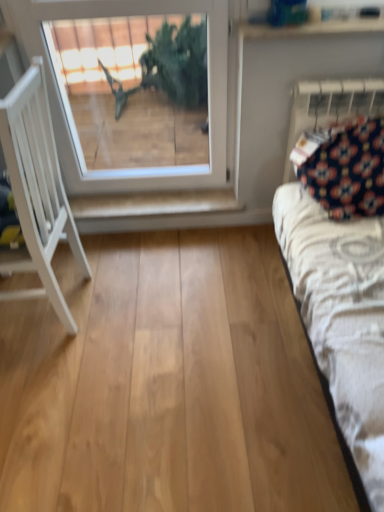
What is the approximate width of dark blue fabric at upper right?

It is 4.82 inches.

Where is `dark blue fabric at upper right`? The height and width of the screenshot is (512, 384). dark blue fabric at upper right is located at coordinates (330, 106).

From a real-world perspective, which is physically below, white painted wood shelf at center or white glass window at upper center?

From a 3D spatial view, white painted wood shelf at center is below.

Is white painted wood shelf at center outside of white glass window at upper center?

white painted wood shelf at center is positioned outside white glass window at upper center.

From the image's perspective, does white painted wood shelf at center appear lower than white glass window at upper center?

Yes, from the image's perspective, white painted wood shelf at center is below white glass window at upper center.

Relative to white glass window at upper center, is white painted wood shelf at center in front or behind?

white painted wood shelf at center is behind white glass window at upper center.

Is white glass window at upper center at the right side of white painted wood shelf at center?

No.

Looking at this image, can we say white glass window at upper center lies outside white painted wood shelf at center?

white glass window at upper center is positioned outside white painted wood shelf at center.

Locate an element on the screen. The image size is (384, 512). shelf that is on the right side of white glass window at upper center is located at coordinates (154, 204).

Does white glass window at upper center have a greater width compared to white painted wood shelf at center?

No.

Identify the location of furniture in front of the white glass window at upper center. This screenshot has width=384, height=512. (37, 189).

From the picture: From the image's perspective, is white glass window at upper center located above white wood chair at left?

Yes.

Considering the sizes of objects white glass window at upper center and white wood chair at left in the image provided, who is wider, white glass window at upper center or white wood chair at left?

With larger width is white wood chair at left.

In the scene shown: Between white glass window at upper center and white wood chair at left, which one appears on the right side from the viewer's perspective?

From the viewer's perspective, white glass window at upper center appears more on the right side.

Which of these two, white painted wood shelf at center or white wood chair at left, is bigger?

With larger size is white wood chair at left.

From the image's perspective, is white painted wood shelf at center under white wood chair at left?

Actually, white painted wood shelf at center appears above white wood chair at left in the image.

This screenshot has width=384, height=512. What are the coordinates of `furniture above the white painted wood shelf at center (from a real-world perspective)` in the screenshot? It's located at (37, 189).

Does white wood chair at left have a lesser height compared to white glass window at upper center?

Incorrect, the height of white wood chair at left does not fall short of that of white glass window at upper center.

Is white wood chair at left wider than white glass window at upper center?

Indeed, white wood chair at left has a greater width compared to white glass window at upper center.

Considering the relative sizes of white wood chair at left and white glass window at upper center in the image provided, is white wood chair at left smaller than white glass window at upper center?

No, white wood chair at left is not smaller than white glass window at upper center.

In the scene shown: From a real-world perspective, is white wood chair at left beneath white glass window at upper center?

Yes, from a real-world perspective, white wood chair at left is below white glass window at upper center.

Between dark blue fabric at upper right and white painted wood shelf at center, which one has more height?

With more height is dark blue fabric at upper right.

Is dark blue fabric at upper right positioned with its back to white painted wood shelf at center?

No.

Which is more to the right, dark blue fabric at upper right or white painted wood shelf at center?

dark blue fabric at upper right is more to the right.

Relative to white painted wood shelf at center, is dark blue fabric at upper right in front or behind?

Clearly, dark blue fabric at upper right is in front of white painted wood shelf at center.

From a real-world perspective, is white wood chair at left located beneath white painted wood shelf at center?

Actually, white wood chair at left is physically above white painted wood shelf at center in the real world.

Considering the sizes of objects white wood chair at left and white painted wood shelf at center in the image provided, who is thinner, white wood chair at left or white painted wood shelf at center?

white painted wood shelf at center is thinner.

Is point (41, 243) closer to camera compared to point (112, 196)?

Yes, point (41, 243) is closer to viewer.

The height and width of the screenshot is (512, 384). I want to click on shelf below the white glass window at upper center (from the image's perspective), so click(x=154, y=204).

Locate an element on the screen. The width and height of the screenshot is (384, 512). shelf lying behind the white glass window at upper center is located at coordinates (154, 204).

Based on their spatial positions, is white wood chair at left or dark blue fabric at upper right closer to white painted wood shelf at center?

Based on the image, white wood chair at left appears to be nearer to white painted wood shelf at center.

Based on their spatial positions, is white glass window at upper center or white wood chair at left further from dark blue fabric at upper right?

white wood chair at left is further to dark blue fabric at upper right.

Estimate the real-world distances between objects in this image. Which object is closer to white wood chair at left, white painted wood shelf at center or dark blue fabric at upper right?

Based on the image, white painted wood shelf at center appears to be nearer to white wood chair at left.

When comparing their distances from white painted wood shelf at center, does white wood chair at left or white glass window at upper center seem further?

Based on the image, white glass window at upper center appears to be further to white painted wood shelf at center.

Based on their spatial positions, is white glass window at upper center or white painted wood shelf at center further from white wood chair at left?

white glass window at upper center lies further to white wood chair at left than the other object.

Looking at the image, which one is located closer to white painted wood shelf at center, white glass window at upper center or white wood chair at left?

white wood chair at left is positioned closer to the anchor white painted wood shelf at center.

When comparing their distances from white wood chair at left, does white glass window at upper center or dark blue fabric at upper right seem further?

Among the two, dark blue fabric at upper right is located further to white wood chair at left.

Looking at the image, which one is located closer to dark blue fabric at upper right, white wood chair at left or white glass window at upper center?

white glass window at upper center.

I want to click on shelf between white wood chair at left and dark blue fabric at upper right, so click(x=154, y=204).

You are a GUI agent. You are given a task and a screenshot of the screen. Output one action in this format:
    pyautogui.click(x=<x>, y=<y>)
    Task: Click on the shelf between white glass window at upper center and dark blue fabric at upper right in the horizontal direction
    
    Given the screenshot: What is the action you would take?
    pyautogui.click(x=154, y=204)

The height and width of the screenshot is (512, 384). Find the location of `window between white wood chair at left and dark blue fabric at upper right in the horizontal direction`. window between white wood chair at left and dark blue fabric at upper right in the horizontal direction is located at coordinates (137, 96).

Find the location of a particular element. The width and height of the screenshot is (384, 512). window positioned between white wood chair at left and white painted wood shelf at center from near to far is located at coordinates (137, 96).